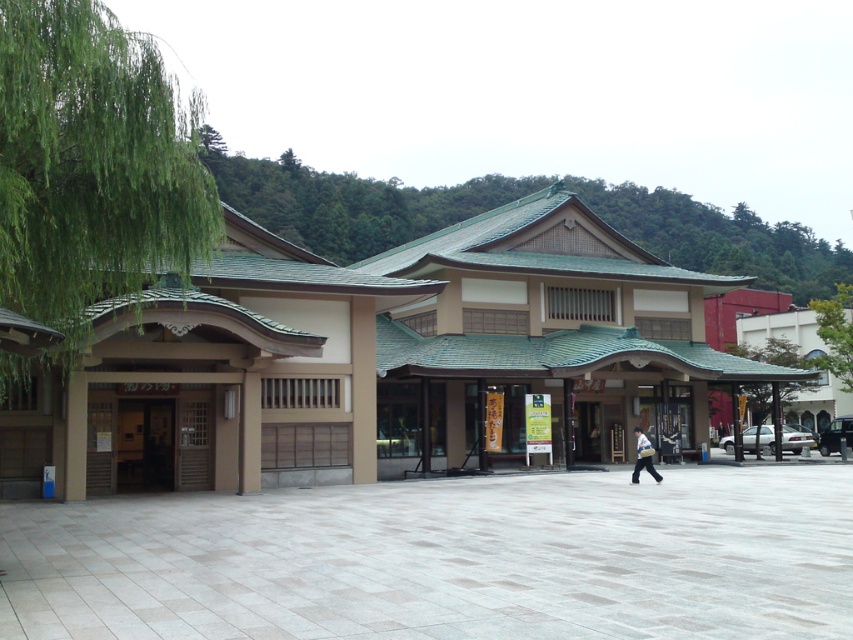
You are standing at the entrance of the traditional building and want to take a photo of both the light gray stone plaza at center and the green leafy tree at right. Which object should you position closer to the camera to ensure both are in frame?

You should position the light gray stone plaza at center closer to the camera because it is shorter than the green leafy tree at right, ensuring both fit within the frame.